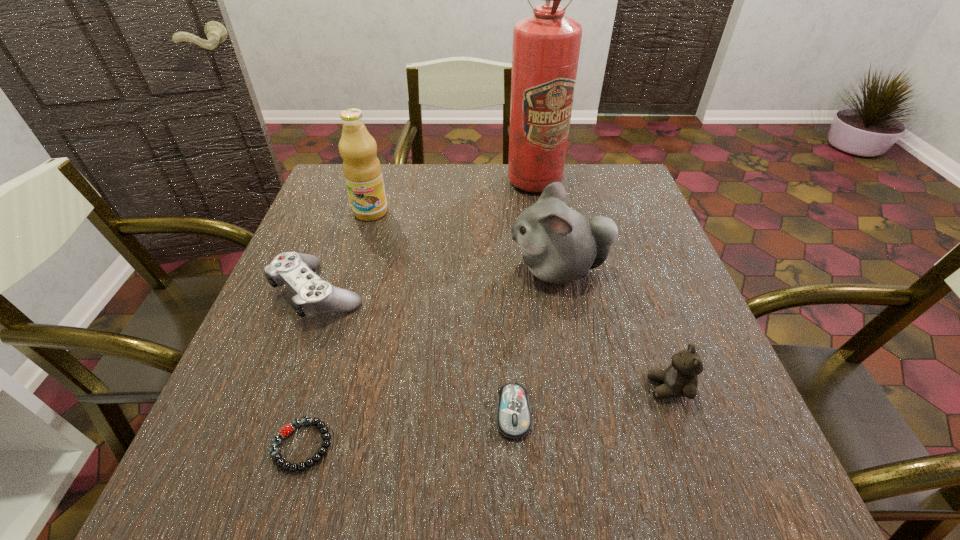
Identify the location of vacant region located 0.170m on the label side of the tallest object. This screenshot has width=960, height=540. tap(543, 235).

Find the location of a particular element. Image resolution: width=960 pixels, height=540 pixels. free spot located on the label of the sixth shortest object is located at coordinates (338, 321).

The image size is (960, 540). I want to click on vacant space located 0.380m on the face of the third tallest object, so click(341, 269).

Where is `vacant space situated on the face of the third tallest object`? Image resolution: width=960 pixels, height=540 pixels. vacant space situated on the face of the third tallest object is located at coordinates (469, 269).

Find the location of `vacant space positioned on the face of the third tallest object`. vacant space positioned on the face of the third tallest object is located at coordinates (372, 269).

This screenshot has width=960, height=540. Find the location of `vacant space located 0.330m on the face of the rightmost object`. vacant space located 0.330m on the face of the rightmost object is located at coordinates (462, 388).

Where is `vacant space located on the face of the rightmost object`? The height and width of the screenshot is (540, 960). vacant space located on the face of the rightmost object is located at coordinates (456, 388).

I want to click on blank space located on the face of the rightmost object, so click(479, 388).

At what (x,y) coordinates should I click in order to perform the action: click on free space located 0.270m on the right of the third shortest object. Please return your answer as a coordinate pair (x, y). The width and height of the screenshot is (960, 540). Looking at the image, I should click on (492, 293).

This screenshot has height=540, width=960. I want to click on vacant space located on the wheel side of the sixth tallest object, so click(x=518, y=500).